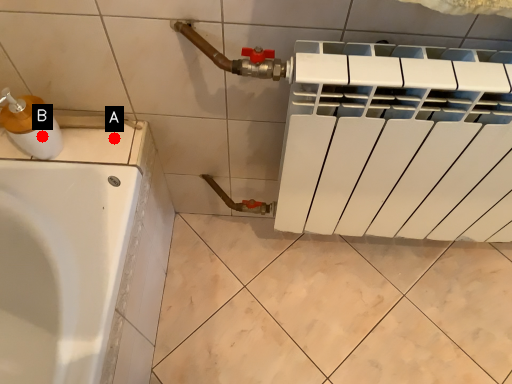
Question: Two points are circled on the image, labeled by A and B beside each circle. Among these points, which one is farthest from the camera?

Choices:
 (A) A is further
 (B) B is further

Answer: (A)